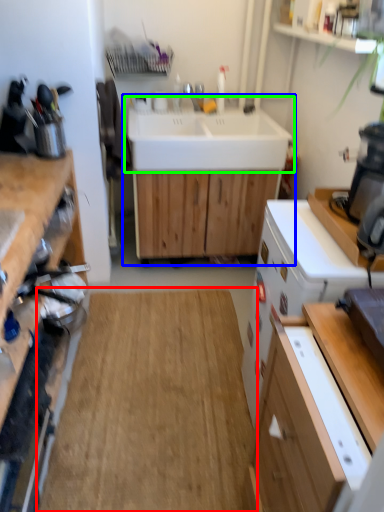
Question: Estimate the real-world distances between objects in this image. Which object is closer to hardwood (highlighted by a red box), sink (highlighted by a blue box) or sink (highlighted by a green box)?

Choices:
 (A) sink
 (B) sink

Answer: (A)